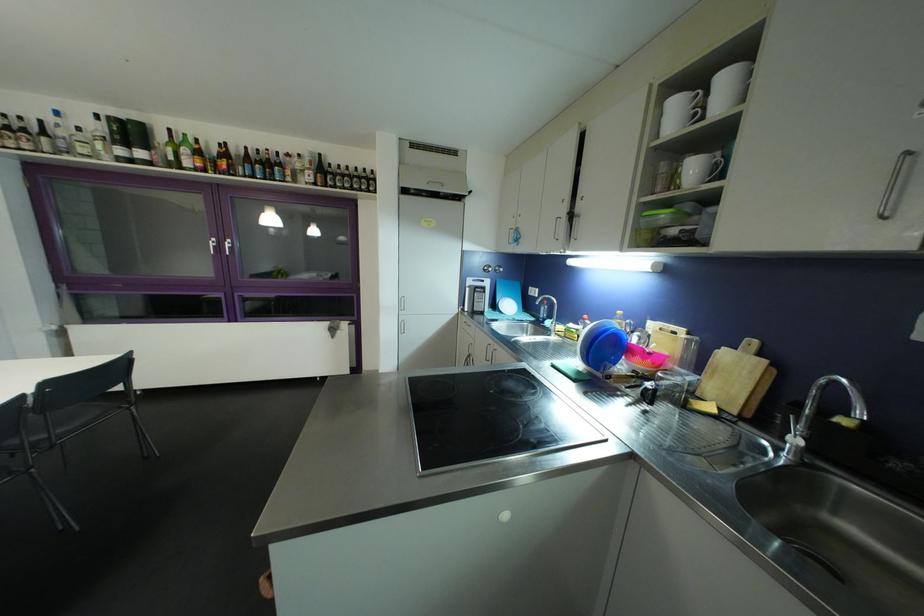
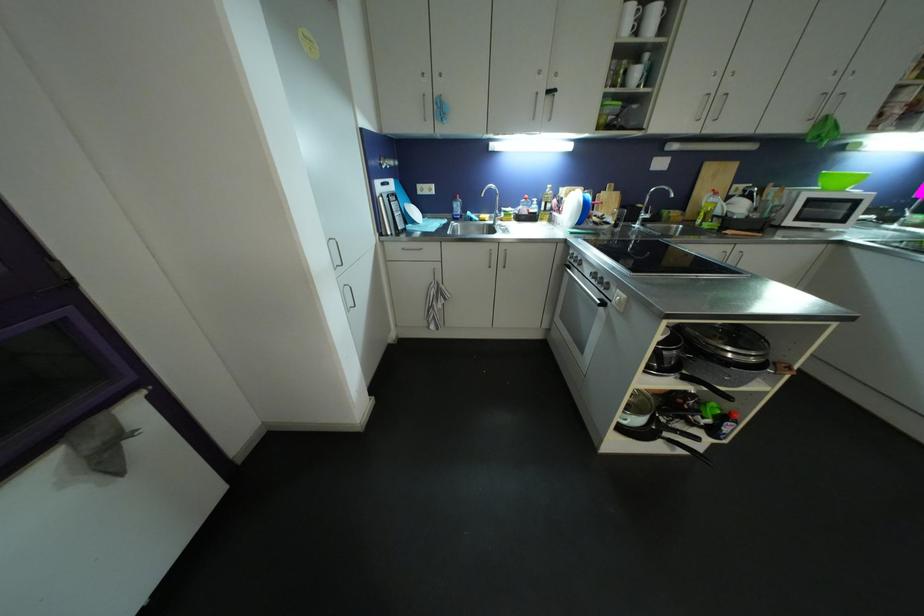
The point at (684, 107) is marked in the first image. Where is the corresponding point in the second image?

(638, 13)